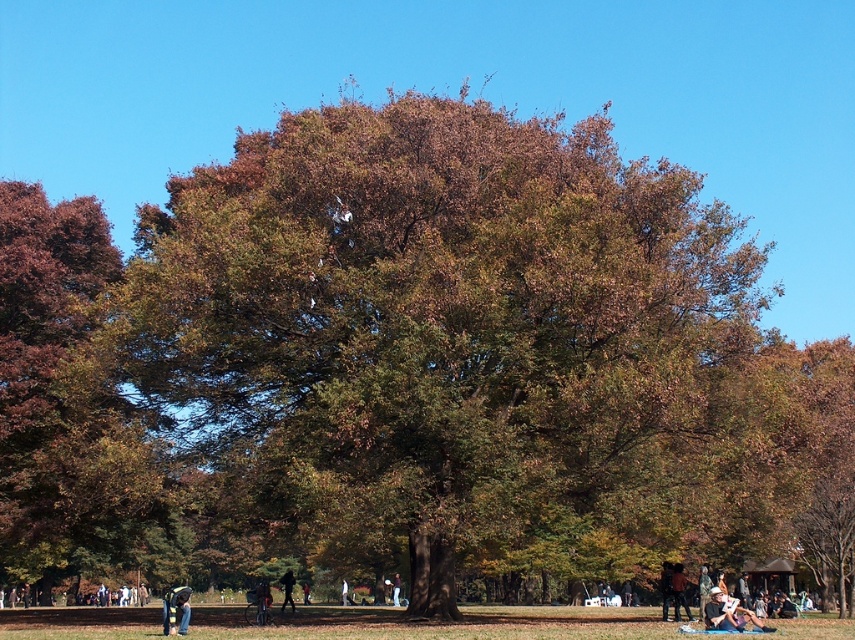
You are planning to take a photo of the brown leafy tree at center and the dark brown leather jacket at lower right. Which object should you focus on first if you want to capture both in one frame without moving the camera?

You should focus on the brown leafy tree at center first because it is larger than the dark brown leather jacket at lower right, so it will occupy more space in the frame and ensure proper composition.

You are standing in the park and see the brown leafy tree at center and the light brown fabric at center. Which object is closer to you?

The brown leafy tree at center is closer to you than the light brown fabric at center.

In the scene shown: You are standing in the park and want to determine the relative positions of two points marked in the scene. Which point, point 1 at coordinates (113,419) or point 2 at coordinates (755,618), is closer to you?

Point 1 at coordinates (113,419) is closer to you because it is further to the viewer than point 2 at coordinates (755,618).